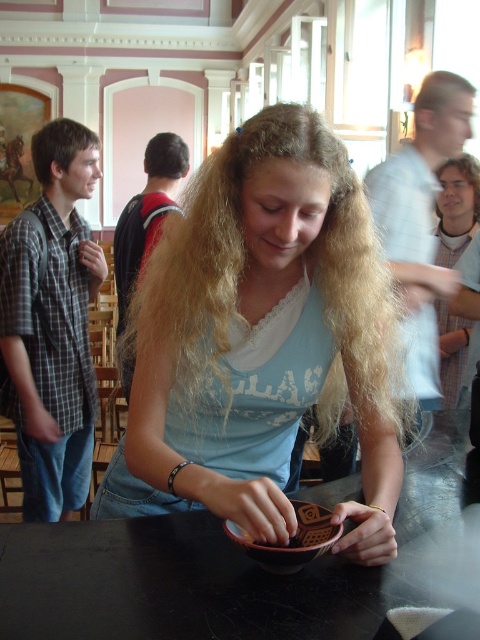
Describe the element at coordinates (52, 324) in the screenshot. Image resolution: width=480 pixels, height=640 pixels. I see `plaid shirt at left` at that location.

Is plaid shirt at left bigger than blonde hair at center?

Yes.

Where is `plaid shirt at left`? plaid shirt at left is located at coordinates (52, 324).

Does black glossy table at center appear over black backpack at upper left?

No, black glossy table at center is not above black backpack at upper left.

Which is behind, point (437, 456) or point (121, 253)?

Point (121, 253)

Who is more distant from viewer, (202, 563) or (162, 196)?

The point (162, 196) is more distant.

Find the location of a particular element. Image resolution: width=480 pixels, height=640 pixels. black glossy table at center is located at coordinates tap(224, 566).

Describe the element at coordinates (263, 340) in the screenshot. The image size is (480, 640). I see `matte brown bowl at center` at that location.

Between point (269, 372) and point (470, 464), which one is positioned behind?

The point (470, 464) is more distant.

Does point (212, 250) lie in front of point (145, 595)?

No, it is not.

Locate an element on the screen. The width and height of the screenshot is (480, 640). matte brown bowl at center is located at coordinates click(263, 340).